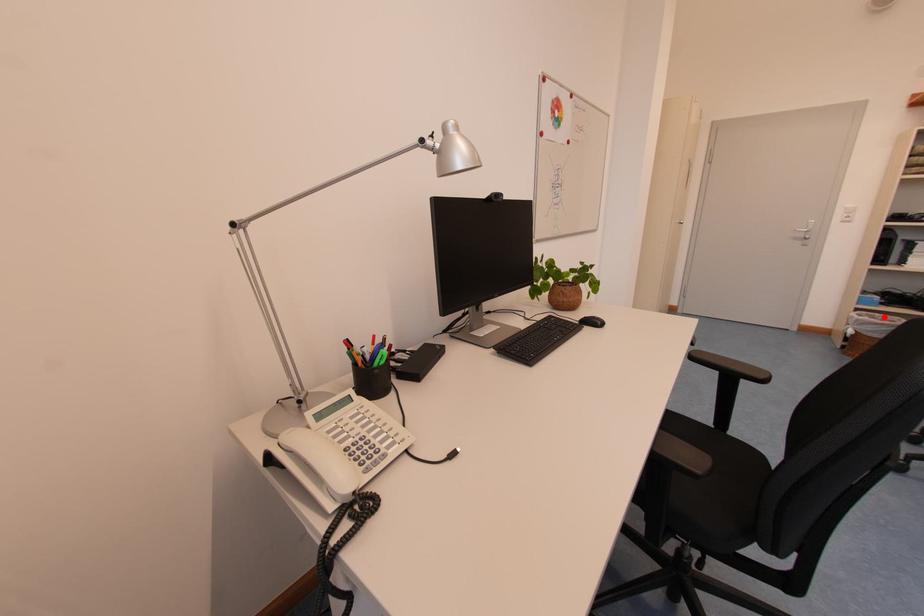
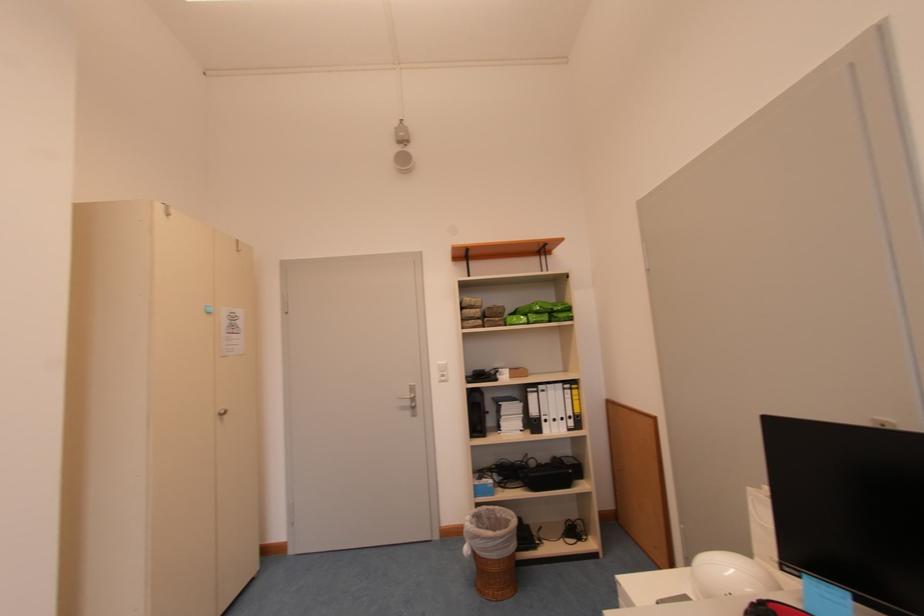
Question: A red point is marked in image1. In image2, is the corresponding 3D point closer to the camera or farther? Reply with the corresponding letter.

Choices:
 (A) The corresponding 3D point is closer.
 (B) The corresponding 3D point is farther.

Answer: (A)